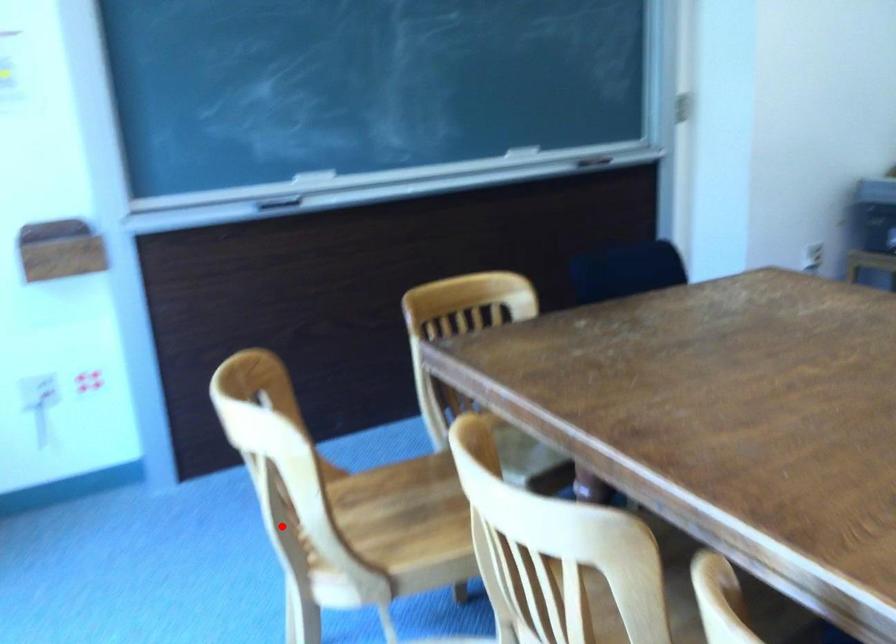
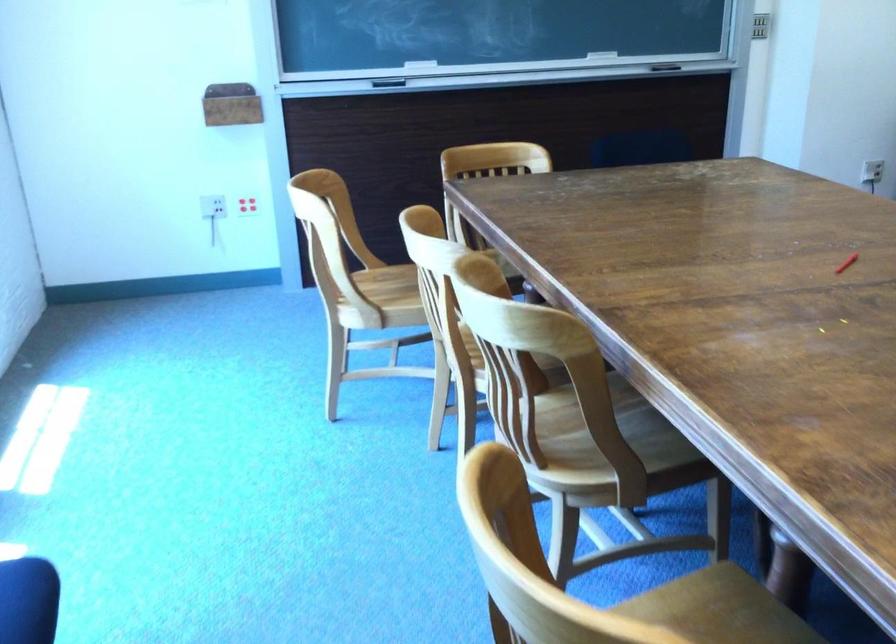
Question: I am providing you with two images of the same scene from different viewpoints. In image1, a red point is highlighted. Considering the same 3D point in image2, which of the following is correct?

Choices:
 (A) It is closer
 (B) It is farther

Answer: (B)